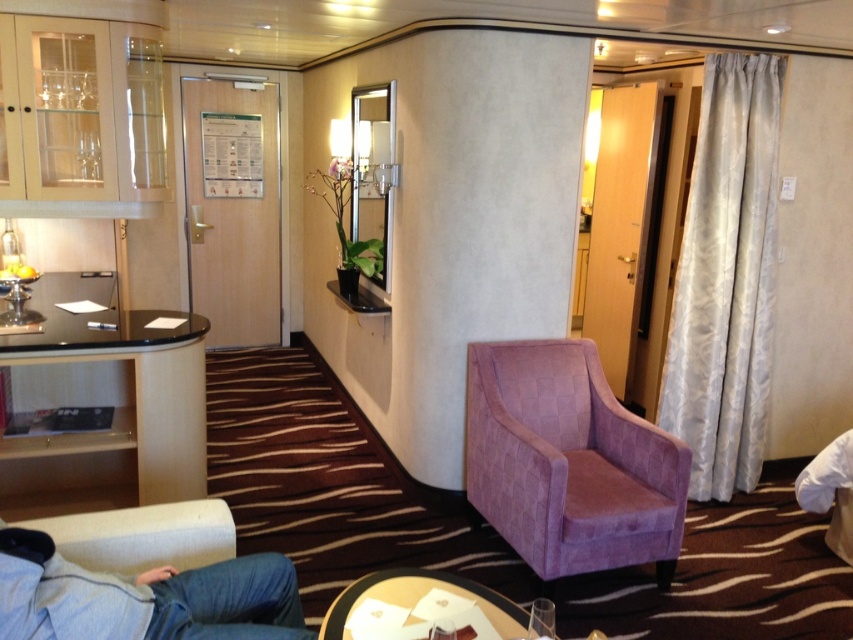
You are a guest in this cabin and want to place a large painting on the wall behind the white textured curtain at right. However, you need to ensure it won not block the view of the wooden round table at center from the main seating area. Can you do this without moving the curtain?

The white textured curtain at right is bigger than wooden round table at center, so placing the painting behind the curtain would still allow the wooden round table at center to be visible from the main seating area as the curtain is larger and can cover the painting while not obstructing the view of the table.

You are a cabin steward on a cruise ship who needs to place a large tray of snacks. You have two tables available in the cabin. Which table, the black glass table at left or the wooden round table at center, can accommodate the tray more comfortably?

The black glass table at left is bigger than the wooden round table at center, so it can accommodate the large tray of snacks more comfortably.